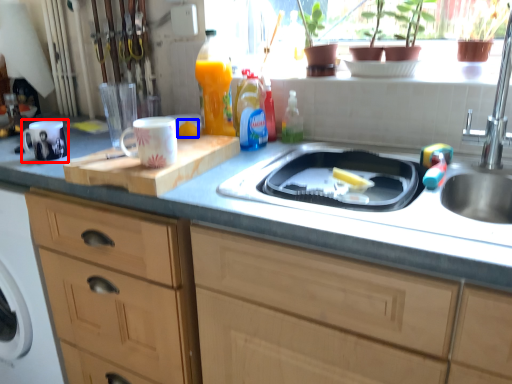
Question: Which object is closer to the camera taking this photo, mug (highlighted by a red box) or food (highlighted by a blue box)?

Choices:
 (A) mug
 (B) food

Answer: (A)